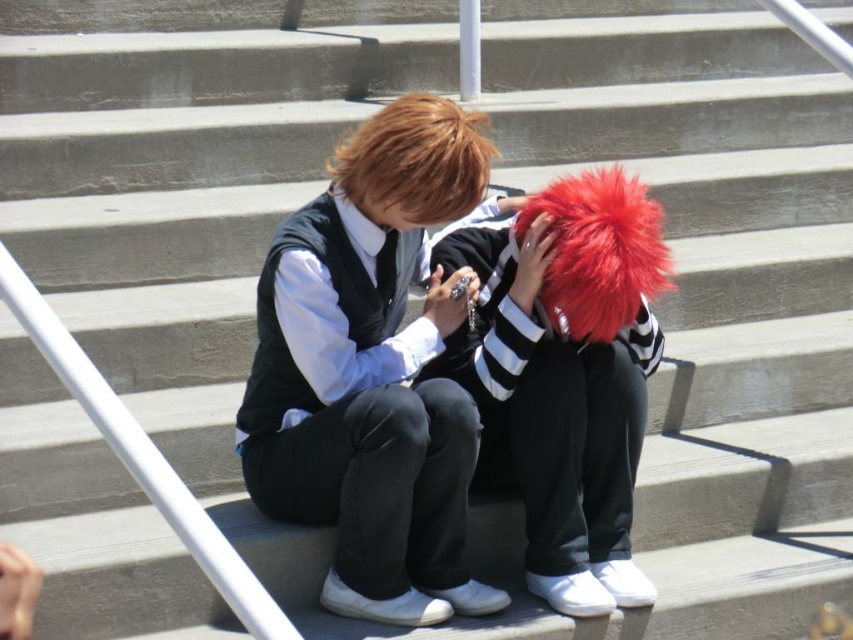
Question: Which object is farther from the camera taking this photo?

Choices:
 (A) matte black vest at center
 (B) fluffy red wig at center
 (C) shiny brown hair at upper center

Answer: (B)

Question: Which of the following is the farthest from the observer?

Choices:
 (A) fluffy red wig at center
 (B) matte black vest at center

Answer: (A)

Question: Which of the following is the farthest from the observer?

Choices:
 (A) (534, 248)
 (B) (416, 532)
 (C) (444, 120)

Answer: (A)

Question: From the image, what is the correct spatial relationship of matte black vest at center in relation to fluffy red wig at center?

Choices:
 (A) above
 (B) below

Answer: (A)

Question: Can you confirm if fluffy red wig at center is wider than shiny brown hair at upper center?

Choices:
 (A) yes
 (B) no

Answer: (A)

Question: Does matte black vest at center have a smaller size compared to fluffy red wig at center?

Choices:
 (A) no
 (B) yes

Answer: (A)